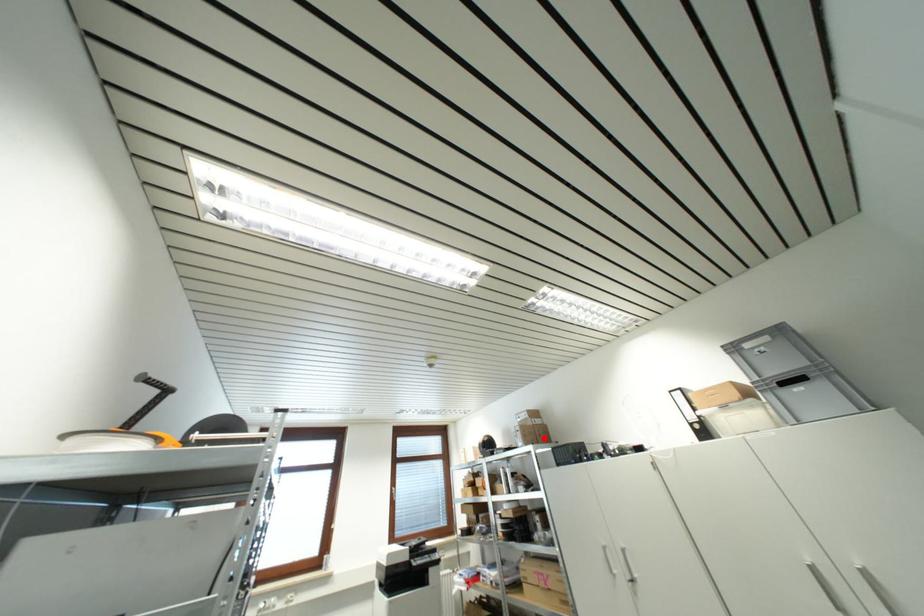
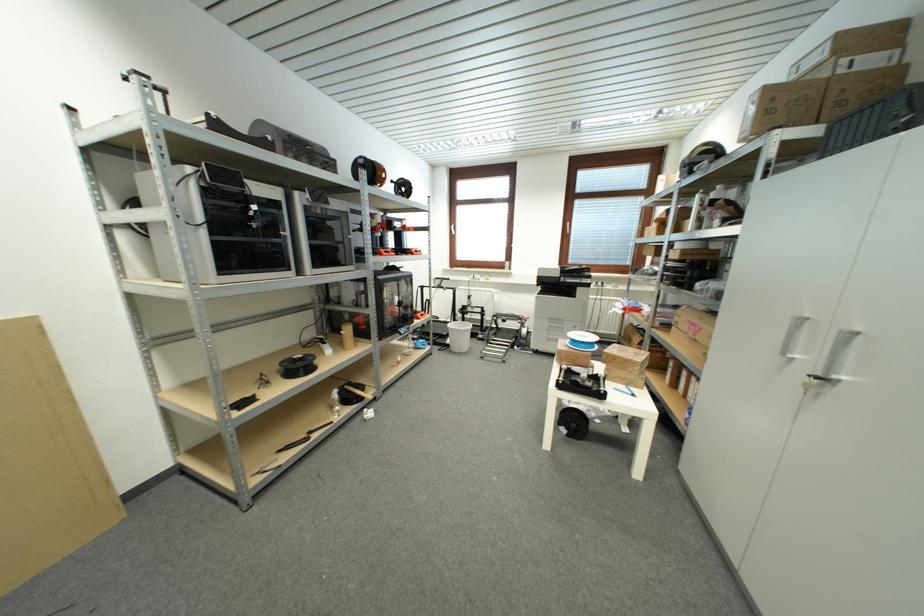
The point at the highlighted location is marked in the first image. Where is the corresponding point in the second image?

(845, 106)